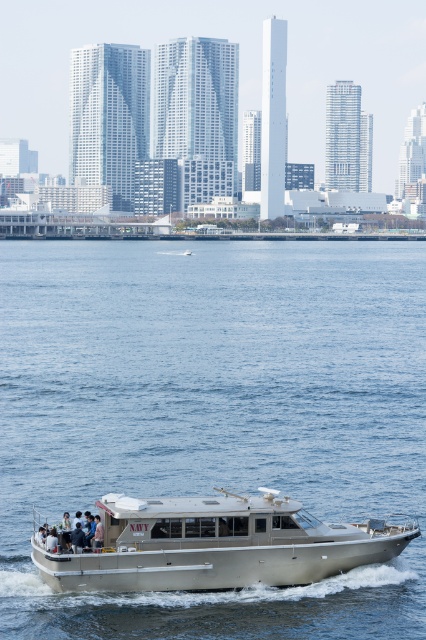
You are on a sightseeing tour and want to take a photo of both the blue water at center and the metallic silver boat at center. Which object should you focus on first to ensure both are in the frame?

You should focus on the blue water at center first since it is closer to the viewer than the metallic silver boat at center, ensuring both remain in the frame.

You are standing on the deck of the beige motorboat labeled NAVY and want to locate two specific points in the scene. The first point is at coordinates point (13,394) and the second point is at coordinates point (382,545). Which point is closer to you?

Point (13,394) is closer to you because it is further to the viewer than point (382,545).